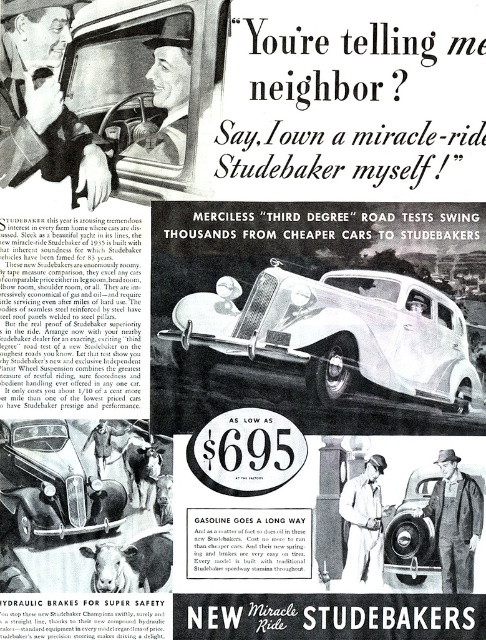
Looking at this image, you are standing in front of the vintage Studebaker advertisement. There are two points marked on the image, one at coordinates point (247, 300) and the other at point (46, 64). Which point is closer to you?

Point (247, 300) is further to the camera than point (46, 64), so the point closer to you is point (46, 64).

In the vintage Studebaker advertisement, there are two items depicted in the scene. One is a smooth leather glove at upper left and the other is overalls at lower right. From the perspective of someone looking at the ad, which of these two items is positioned to the left?

The smooth leather glove at upper left is positioned to the left of the overalls at lower right.

In the scene shown: In the vintage Studebaker advertisement, there is a smooth leather glove at upper left and overalls at lower right. Which object is wider?

The smooth leather glove at upper left is wider than the overalls at lower right.